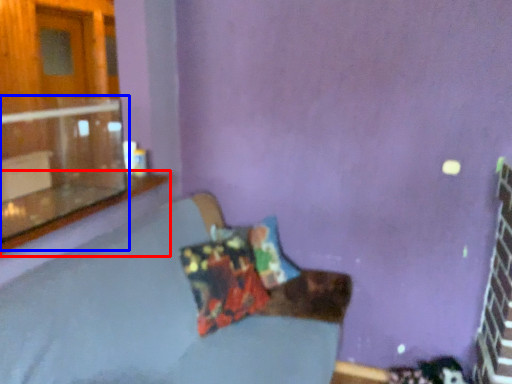
Question: Which object appears farthest to the camera in this image, window sill (highlighted by a red box) or window (highlighted by a blue box)?

Choices:
 (A) window sill
 (B) window

Answer: (A)